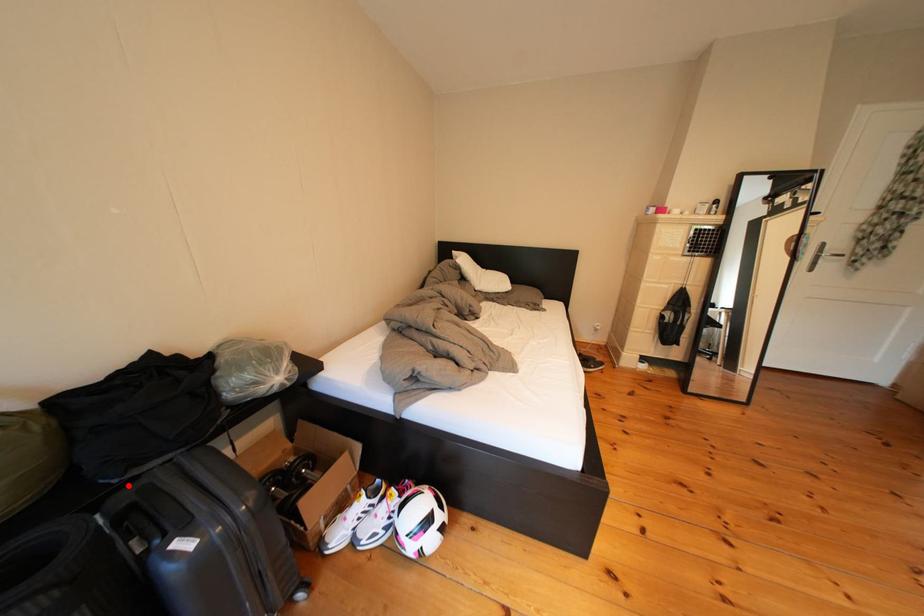
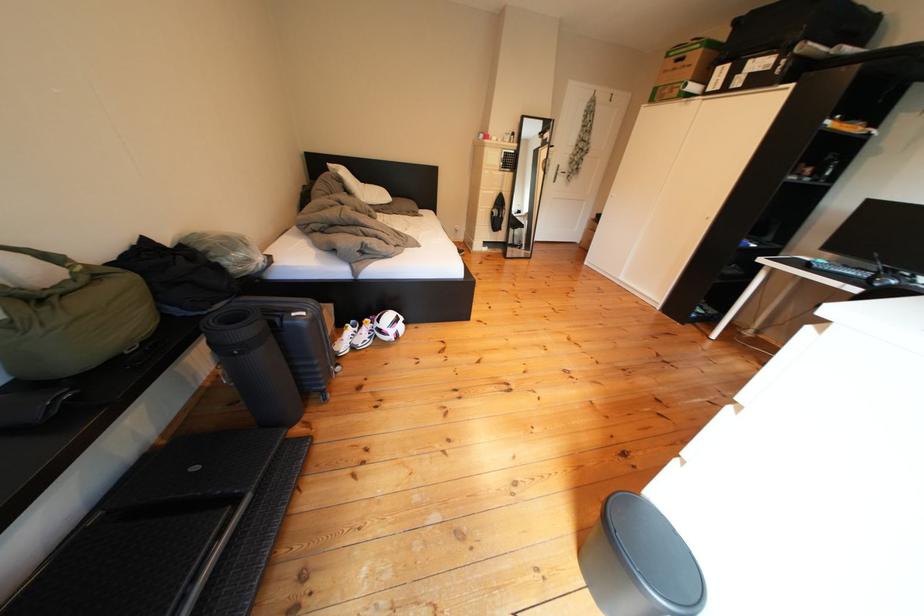
In the second image, find the point that corresponds to the highlighted location in the first image.

(217, 318)